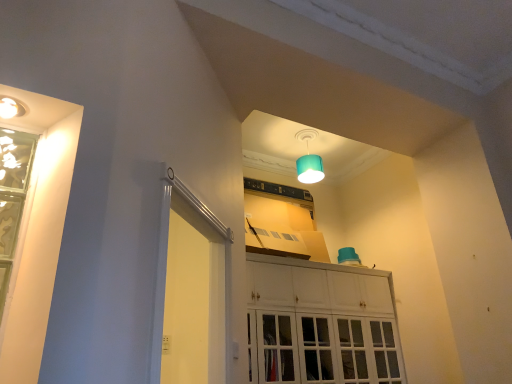
Question: Is white glossy screen door at left in front of white glossy cabinet at center?

Choices:
 (A) yes
 (B) no

Answer: (A)

Question: Would you say white glossy screen door at left is outside white glossy cabinet at center?

Choices:
 (A) no
 (B) yes

Answer: (B)

Question: Is white glossy screen door at left at the left side of white glossy cabinet at center?

Choices:
 (A) yes
 (B) no

Answer: (A)

Question: From a real-world perspective, is white glossy screen door at left physically below white glossy cabinet at center?

Choices:
 (A) yes
 (B) no

Answer: (A)

Question: Can you confirm if white glossy screen door at left is wider than white glossy cabinet at center?

Choices:
 (A) no
 (B) yes

Answer: (A)

Question: Which is correct: green glass window at left is inside teal fabric lampshade at upper center, or outside of it?

Choices:
 (A) inside
 (B) outside

Answer: (B)

Question: From their relative heights in the image, would you say green glass window at left is taller or shorter than teal fabric lampshade at upper center?

Choices:
 (A) tall
 (B) short

Answer: (A)

Question: Considering their positions, is green glass window at left located in front of or behind teal fabric lampshade at upper center?

Choices:
 (A) front
 (B) behind

Answer: (A)

Question: From a real-world perspective, is green glass window at left positioned above or below teal fabric lampshade at upper center?

Choices:
 (A) above
 (B) below

Answer: (B)

Question: Looking at their shapes, would you say white glossy cabinet at center is wider or thinner than teal fabric lampshade at upper center?

Choices:
 (A) wide
 (B) thin

Answer: (A)

Question: From a real-world perspective, is white glossy cabinet at center physically located above or below teal fabric lampshade at upper center?

Choices:
 (A) below
 (B) above

Answer: (A)

Question: From the image's perspective, relative to teal fabric lampshade at upper center, is white glossy cabinet at center above or below?

Choices:
 (A) above
 (B) below

Answer: (B)

Question: Is white glossy cabinet at center in front of or behind teal fabric lampshade at upper center in the image?

Choices:
 (A) behind
 (B) front

Answer: (B)

Question: Looking at their shapes, would you say green glass window at left is wider or thinner than white glossy cabinet at center?

Choices:
 (A) thin
 (B) wide

Answer: (A)

Question: From their relative heights in the image, would you say green glass window at left is taller or shorter than white glossy cabinet at center?

Choices:
 (A) short
 (B) tall

Answer: (A)